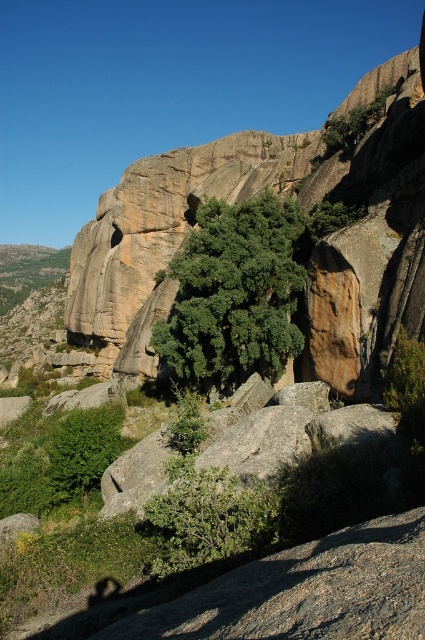
Is green leafy bush at center bigger than green leafy tree at upper center?

Actually, green leafy bush at center might be smaller than green leafy tree at upper center.

How distant is green leafy bush at center from green leafy tree at upper center?

A distance of 165.21 feet exists between green leafy bush at center and green leafy tree at upper center.

What do you see at coordinates (207, 516) in the screenshot?
I see `green leafy bush at center` at bounding box center [207, 516].

In order to click on green leafy bush at center in this screenshot , I will do `click(207, 516)`.

Is green leafy tree at center above green leafy bush at center?

Yes.

Locate an element on the screen. Image resolution: width=425 pixels, height=640 pixels. green leafy tree at center is located at coordinates (234, 294).

Is point (292, 324) more distant than point (164, 518)?

Yes, point (292, 324) is farther from viewer.

At what (x,y) coordinates should I click in order to perform the action: click on green leafy tree at center. Please return your answer as a coordinate pair (x, y). Image resolution: width=425 pixels, height=640 pixels. Looking at the image, I should click on (234, 294).

In the scene shown: Is green leafy tree at center above green leafy tree at upper center?

Actually, green leafy tree at center is below green leafy tree at upper center.

I want to click on green leafy tree at center, so click(x=234, y=294).